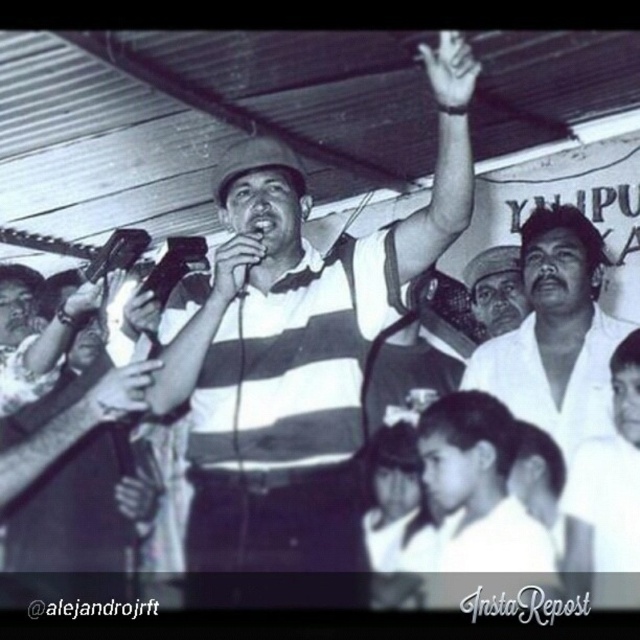
You are standing in the crowd at this event and want to take a photo of the two points mentioned. Which point, point (116, 378) or point (138, 252), will appear larger in your photo?

Point (116, 378) is closer to the viewer than point (138, 252), so it will appear larger in the photo.

You are standing in the same room as the man with the microphone. You want to move from the point at coordinates point [433,65] to the point at coordinates point [230,278]. Which direction should you move relative to your current position?

You should move away from the central figure holding the microphone because point [230,278] is farther from the viewer compared to point [433,65].

You are a photographer at the event and want to capture a clear photo of the metallic shiny microphone at center without the black matte hand at center blocking it. How should you adjust your camera angle?

The black matte hand at center is located below the metallic shiny microphone at center. To avoid the hand blocking the microphone, you can angle your camera slightly upward to focus on the microphone above the hand.